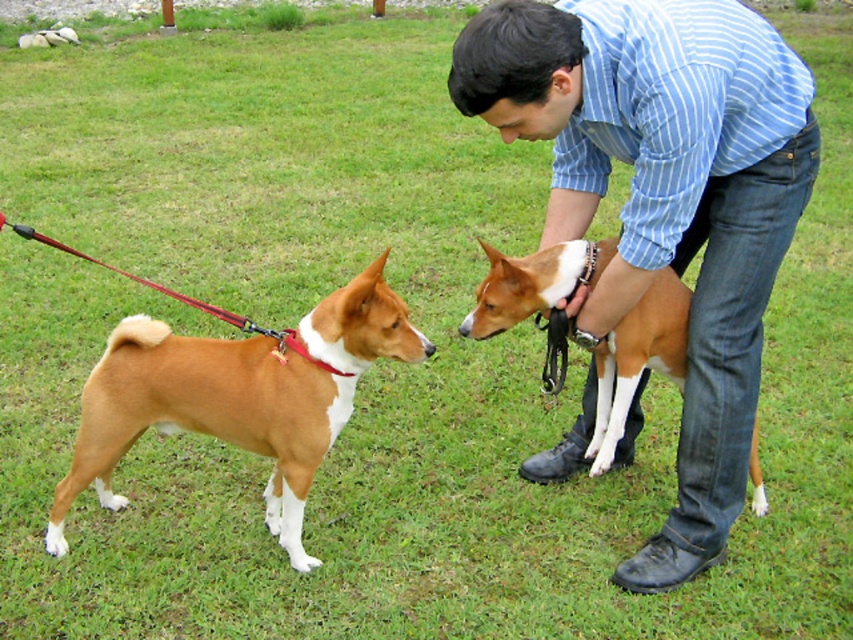
Does blue striped shirt at upper center appear on the left side of red fabric leash at left?

Incorrect, blue striped shirt at upper center is not on the left side of red fabric leash at left.

Is blue striped shirt at upper center positioned at the back of red fabric leash at left?

No, blue striped shirt at upper center is in front of red fabric leash at left.

Which is in front, point (664, 241) or point (291, 339)?

Point (664, 241)

What are the coordinates of `blue striped shirt at upper center` in the screenshot? It's located at (663, 198).

The height and width of the screenshot is (640, 853). What do you see at coordinates (663, 198) in the screenshot?
I see `blue striped shirt at upper center` at bounding box center [663, 198].

Can you confirm if blue striped shirt at upper center is smaller than brown smooth dog at left?

No.

Between point (463, 72) and point (183, 346), which one is positioned in front?

Positioned in front is point (463, 72).

Locate an element on the screen. blue striped shirt at upper center is located at coordinates (663, 198).

Between brown smooth dog at left and red fabric leash at left, which one has more height?

Standing taller between the two is brown smooth dog at left.

Is brown smooth dog at left positioned before red fabric leash at left?

Yes, brown smooth dog at left is closer to the viewer.

At what (x,y) coordinates should I click in order to perform the action: click on brown smooth dog at left. Please return your answer as a coordinate pair (x, y). The image size is (853, 640). Looking at the image, I should click on (236, 397).